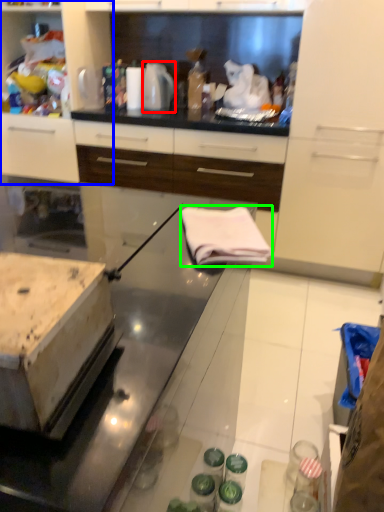
Question: Based on their relative distances, which object is farther from kitchen appliance (highlighted by a red box)? Choose from cabinetry (highlighted by a blue box) and cloth (highlighted by a green box).

Choices:
 (A) cabinetry
 (B) cloth

Answer: (B)